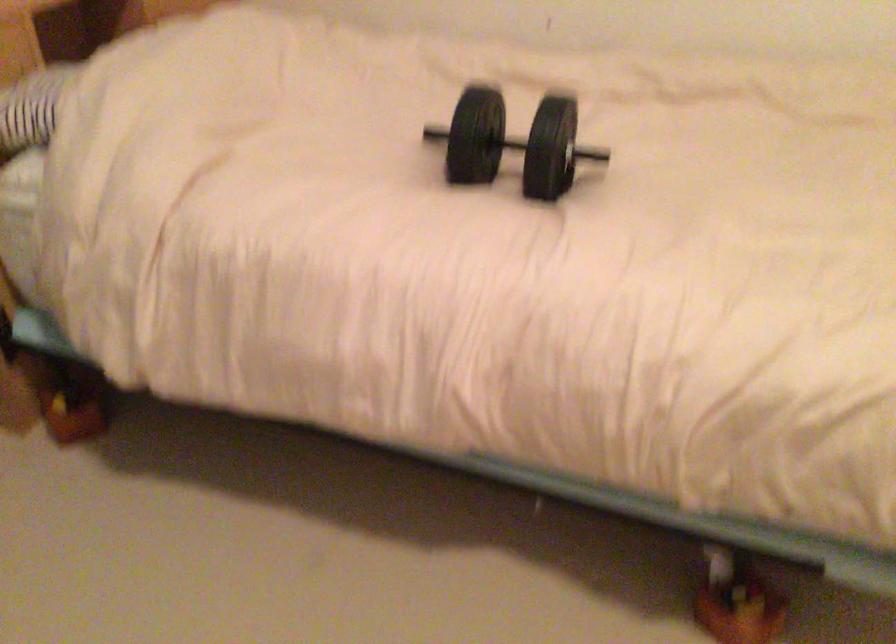
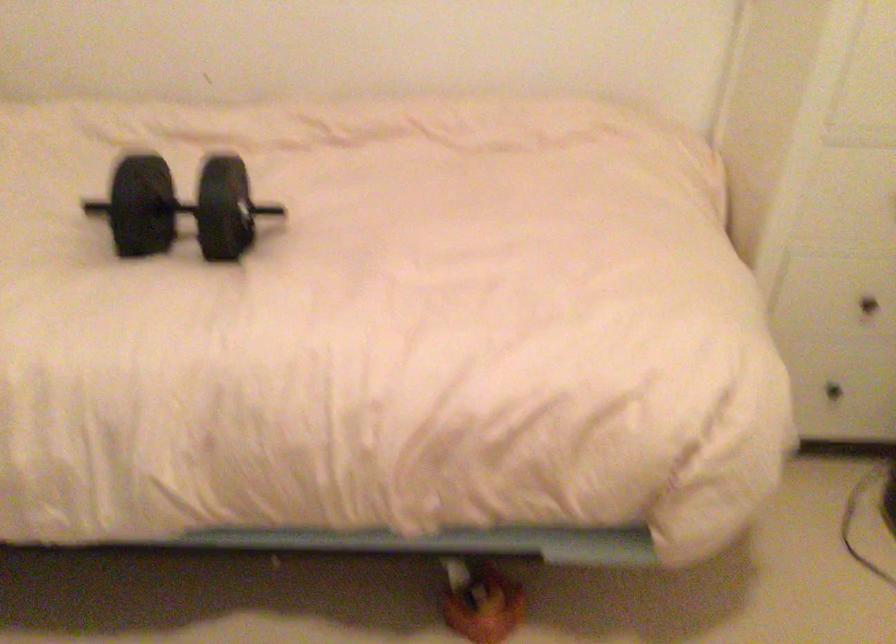
Question: The images are taken continuously from a first-person perspective. In which direction is your viewpoint rotating?

Choices:
 (A) Left
 (B) Right
 (C) Up
 (D) Down

Answer: (B)